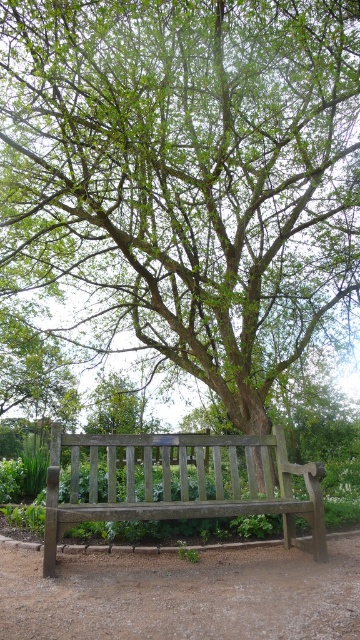
You are standing at the edge of the dirt path at lower center and want to sit on the wooden bench at center. Which direction should you move to reach it?

The wooden bench at center is farther away from you compared to the dirt path at lower center, so you should move backward to reach it.

You are standing at the edge of the scene and want to walk to the dirt path at lower center. Based on its 2D coordinates, in which general direction should you move relative to your current position?

The dirt path at lower center is located at coordinates 0.931 on the x axis and 0.508 on the y axis. Since you are at the edge of the scene, you should move towards the center of the image to reach the dirt path at lower center.